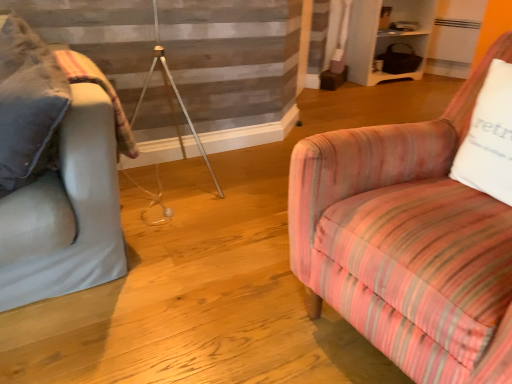
Question: Is light gray fabric couch at left not near white cotton pillow at right?

Choices:
 (A) yes
 (B) no

Answer: (A)

Question: Is light gray fabric couch at left positioned in front of white cotton pillow at right?

Choices:
 (A) no
 (B) yes

Answer: (B)

Question: Is light gray fabric couch at left outside of white cotton pillow at right?

Choices:
 (A) no
 (B) yes

Answer: (B)

Question: Can you confirm if light gray fabric couch at left is positioned to the left of white cotton pillow at right?

Choices:
 (A) no
 (B) yes

Answer: (B)

Question: Does light gray fabric couch at left have a lesser height compared to white cotton pillow at right?

Choices:
 (A) yes
 (B) no

Answer: (B)

Question: In terms of height, does white cotton pillow at right look taller or shorter compared to pink striped fabric chair at right?

Choices:
 (A) tall
 (B) short

Answer: (B)

Question: Is white cotton pillow at right wider or thinner than pink striped fabric chair at right?

Choices:
 (A) wide
 (B) thin

Answer: (B)

Question: Considering their positions, is white cotton pillow at right located in front of or behind pink striped fabric chair at right?

Choices:
 (A) front
 (B) behind

Answer: (B)

Question: Is point (492, 148) positioned closer to the camera than point (394, 269)?

Choices:
 (A) closer
 (B) farther

Answer: (B)

Question: Is point (84, 79) positioned closer to the camera than point (346, 213)?

Choices:
 (A) farther
 (B) closer

Answer: (A)

Question: In terms of height, does plush beige blanket at left look taller or shorter compared to pink striped fabric chair at right?

Choices:
 (A) short
 (B) tall

Answer: (A)

Question: From the image's perspective, is plush beige blanket at left above or below pink striped fabric chair at right?

Choices:
 (A) above
 (B) below

Answer: (A)

Question: From a real-world perspective, is plush beige blanket at left physically located above or below pink striped fabric chair at right?

Choices:
 (A) below
 (B) above

Answer: (B)

Question: In terms of height, does pink striped fabric chair at right look taller or shorter compared to white cotton pillow at right?

Choices:
 (A) tall
 (B) short

Answer: (A)

Question: Is pink striped fabric chair at right inside the boundaries of white cotton pillow at right, or outside?

Choices:
 (A) outside
 (B) inside

Answer: (A)